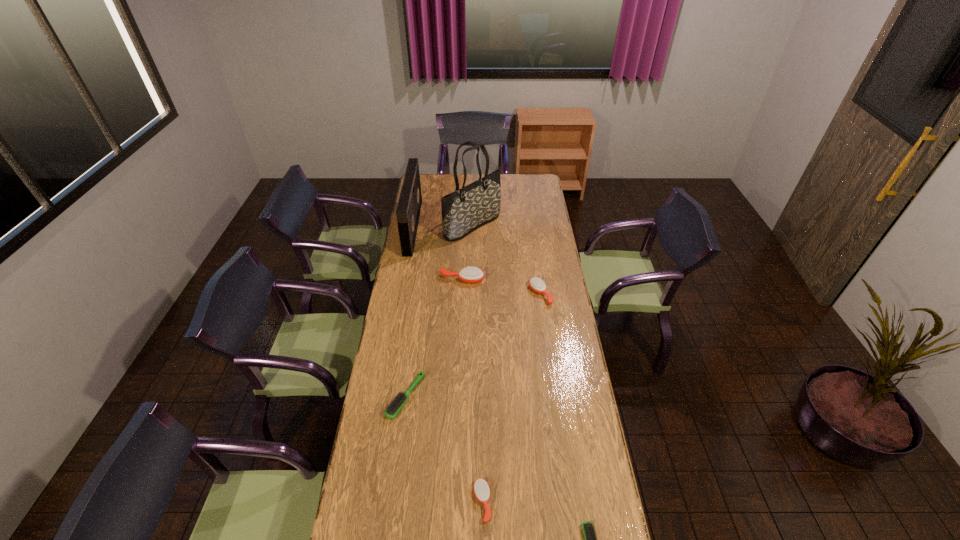
Find the location of `the tallest object`. the tallest object is located at coordinates (464, 210).

The image size is (960, 540). I want to click on tote bag, so click(x=464, y=210).

What are the coordinates of `the sixth shortest object` in the screenshot? It's located at (408, 209).

Where is `videotape`? Image resolution: width=960 pixels, height=540 pixels. videotape is located at coordinates (408, 209).

Where is `the fifth shortest object`? The height and width of the screenshot is (540, 960). the fifth shortest object is located at coordinates (471, 274).

Where is `the biggest orange hairbrush`? the biggest orange hairbrush is located at coordinates (471, 274).

Locate an element on the screen. the fourth tallest object is located at coordinates (536, 284).

The image size is (960, 540). Identify the location of the second smallest orange hairbrush. (536, 284).

You are a GUI agent. You are given a task and a screenshot of the screen. Output one action in this format:
    pyautogui.click(x=<x>, y=<y>)
    Task: Click on the leftmost hairbrush
    This screenshot has height=540, width=960.
    Given the screenshot: What is the action you would take?
    pyautogui.click(x=398, y=401)

I want to click on the farther light hairbrush, so click(398, 401).